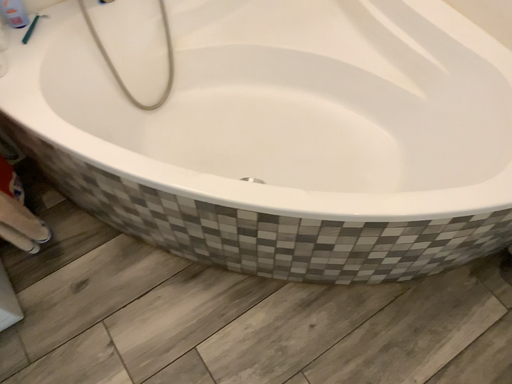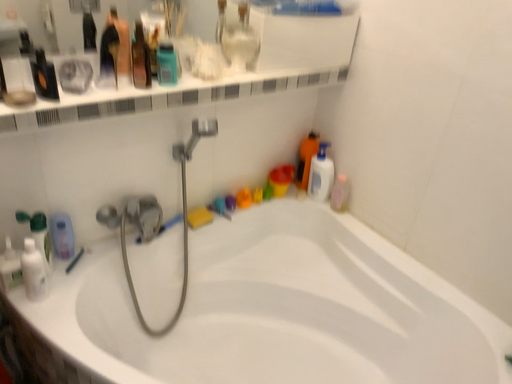
Question: Which way did the camera rotate in the video?

Choices:
 (A) rotated upward
 (B) rotated downward

Answer: (A)